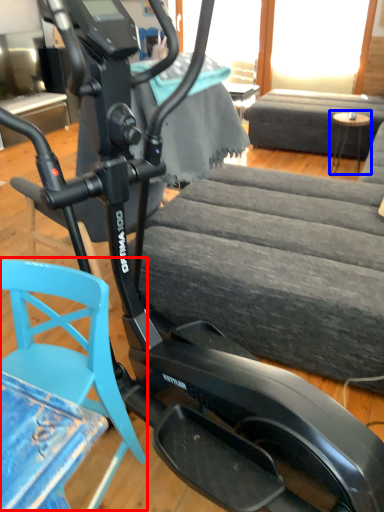
Question: Which object is further to the camera taking this photo, swivel chair (highlighted by a red box) or table (highlighted by a blue box)?

Choices:
 (A) swivel chair
 (B) table

Answer: (B)